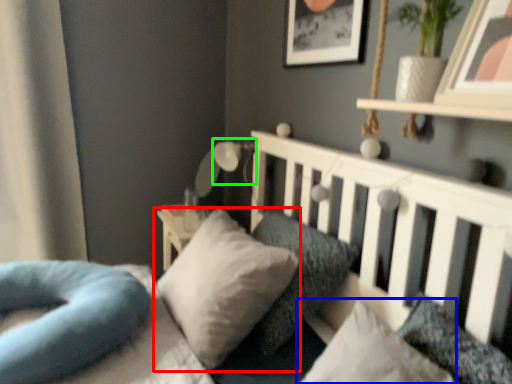
Question: Based on their relative distances, which object is farther from pillow (highlighted by a red box)? Choose from pillow (highlighted by a blue box) and lamp (highlighted by a green box).

Choices:
 (A) pillow
 (B) lamp

Answer: (B)